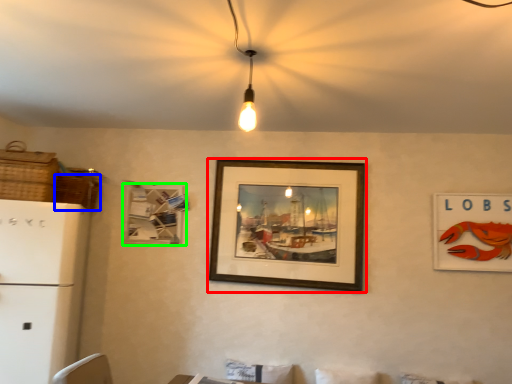
Question: Considering the real-world distances, which object is farthest from picture frame (highlighted by a red box)? basket (highlighted by a blue box) or picture frame (highlighted by a green box)?

Choices:
 (A) basket
 (B) picture frame

Answer: (A)